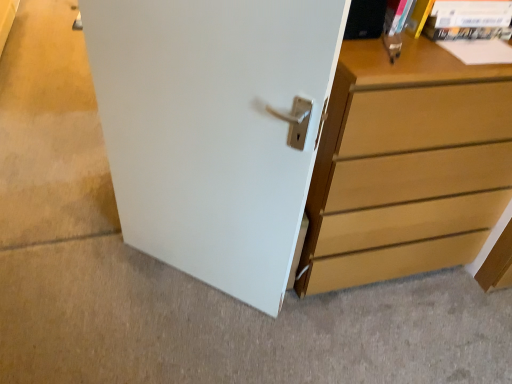
You are a GUI agent. You are given a task and a screenshot of the screen. Output one action in this format:
    pyautogui.click(x=<x>, y=<y>)
    Task: Click on the white matte door at center
    The image size is (512, 384).
    Given the screenshot: What is the action you would take?
    pyautogui.click(x=214, y=129)

Locate an element on the screen. Image resolution: width=512 pixels, height=384 pixels. white smooth door at center is located at coordinates (236, 326).

Between white matte door at center and white smooth door at center, which one has smaller size?

With smaller size is white smooth door at center.

Does white matte door at center lie behind white smooth door at center?

No.

Based on their positions, is white matte door at center located to the left or right of white smooth door at center?

white matte door at center is positioned on white smooth door at center's left side.

Which is behind, point (374, 272) or point (248, 50)?

The point (374, 272) is farther.

Is light brown wood chest of drawers at right further to the viewer compared to white matte door at center?

Yes, light brown wood chest of drawers at right is further from the camera.

Between light brown wood chest of drawers at right and white matte door at center, which one has smaller size?

white matte door at center.

Considering the relative sizes of light brown wood chest of drawers at right and white matte door at center in the image provided, is light brown wood chest of drawers at right wider than white matte door at center?

Yes.

Looking at the image, does white matte door at center seem bigger or smaller compared to light brown wood chest of drawers at right?

white matte door at center is smaller than light brown wood chest of drawers at right.

Can you confirm if white matte door at center is wider than light brown wood chest of drawers at right?

In fact, white matte door at center might be narrower than light brown wood chest of drawers at right.

Consider the image. How different are the orientations of white matte door at center and light brown wood chest of drawers at right in degrees?

44.3 degrees.

Who is taller, white matte door at center or light brown wood chest of drawers at right?

With more height is white matte door at center.

Visually, is white smooth door at center positioned to the left or to the right of white matte door at center?

white smooth door at center is to the right of white matte door at center.

Does point (138, 370) appear closer or farther from the camera than point (154, 187)?

Clearly, point (138, 370) is closer to the camera than point (154, 187).

Is white matte door at center surrounded by white smooth door at center?

No, white matte door at center is not a part of white smooth door at center.

Is white smooth door at center facing away from white matte door at center?

Yes.

Is light brown wood chest of drawers at right taller or shorter than white smooth door at center?

Considering their sizes, light brown wood chest of drawers at right has more height than white smooth door at center.

Is point (480, 218) more distant than point (21, 372)?

Yes, point (480, 218) is behind point (21, 372).

Choose the correct answer: Is light brown wood chest of drawers at right inside white smooth door at center or outside it?

light brown wood chest of drawers at right cannot be found inside white smooth door at center.

Which object is wider, light brown wood chest of drawers at right or white smooth door at center?

With larger width is white smooth door at center.

From the image's perspective, is white smooth door at center under light brown wood chest of drawers at right?

Indeed, from the image's perspective, white smooth door at center is shown beneath light brown wood chest of drawers at right.

Does white smooth door at center appear on the left side of light brown wood chest of drawers at right?

Correct, you'll find white smooth door at center to the left of light brown wood chest of drawers at right.

Does point (95, 318) appear closer or farther from the camera than point (303, 254)?

Point (95, 318) appears to be farther away from the viewer than point (303, 254).

Measure the distance from white smooth door at center to light brown wood chest of drawers at right.

white smooth door at center and light brown wood chest of drawers at right are 22.34 inches apart from each other.

Where is `concrete behind the white matte door at center`? The width and height of the screenshot is (512, 384). concrete behind the white matte door at center is located at coordinates (236, 326).

At what (x,y) coordinates should I click in order to perform the action: click on door below the light brown wood chest of drawers at right (from the image's perspective). Please return your answer as a coordinate pair (x, y). Looking at the image, I should click on (214, 129).

Considering their positions, is light brown wood chest of drawers at right positioned further to white smooth door at center than white matte door at center?

light brown wood chest of drawers at right lies further to white smooth door at center than the other object.

Looking at the image, which one is located closer to light brown wood chest of drawers at right, white matte door at center or white smooth door at center?

white matte door at center lies closer to light brown wood chest of drawers at right than the other object.

When comparing their distances from white matte door at center, does light brown wood chest of drawers at right or white smooth door at center seem further?

Among the two, white smooth door at center is located further to white matte door at center.

Based on their spatial positions, is white matte door at center or light brown wood chest of drawers at right closer to white smooth door at center?

white matte door at center is closer to white smooth door at center.

When comparing their distances from light brown wood chest of drawers at right, does white smooth door at center or white matte door at center seem closer?

The object closer to light brown wood chest of drawers at right is white matte door at center.

From the image, which object appears to be farther from white matte door at center, white smooth door at center or light brown wood chest of drawers at right?

Among the two, white smooth door at center is located further to white matte door at center.

In order to click on concrete situated between white matte door at center and light brown wood chest of drawers at right from left to right in this screenshot , I will do `click(236, 326)`.